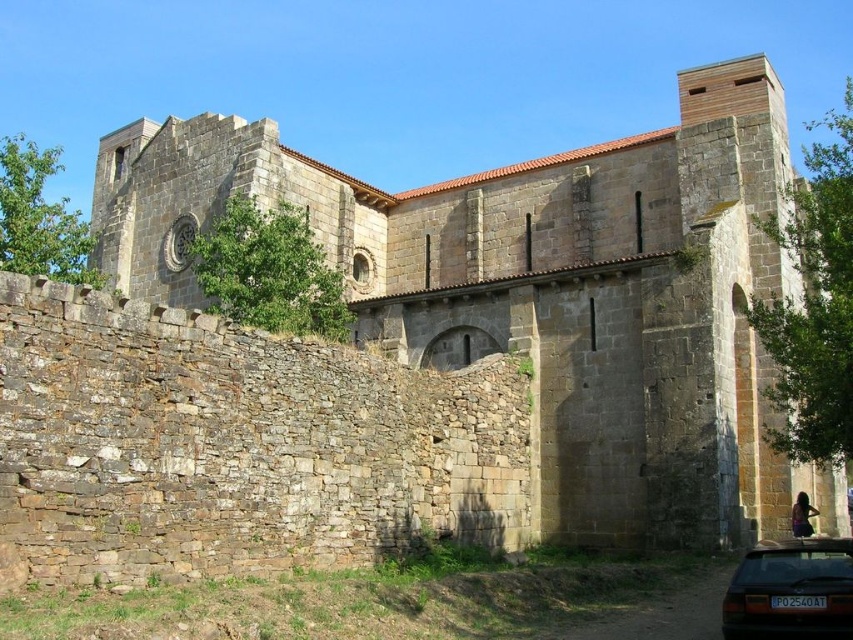
You are a photographer planning to take a wide shot of the stone church at center and the dark brown metallic car at lower right. Given that the church is much bigger, how does the size of the car compare to the church in the photo?

The stone church at center is larger in size than the dark brown metallic car at lower right, so in the photo, the car will appear smaller compared to the church.

Consider the image. You are standing at the coordinates point 0.5, 0.6. You want to reach the stone church at center. Which direction should you move?

Since the stone church at center is located at point (543, 292), and you are at point (511, 320), you should move northeast to reach it.

You are a photographer planning to take a wide shot of the stone church at center and the dark brown metallic car at lower right. Based on their sizes, which one should appear larger in the photo?

The stone church at center might be wider than the dark brown metallic car at lower right, so it should appear larger in the photo.